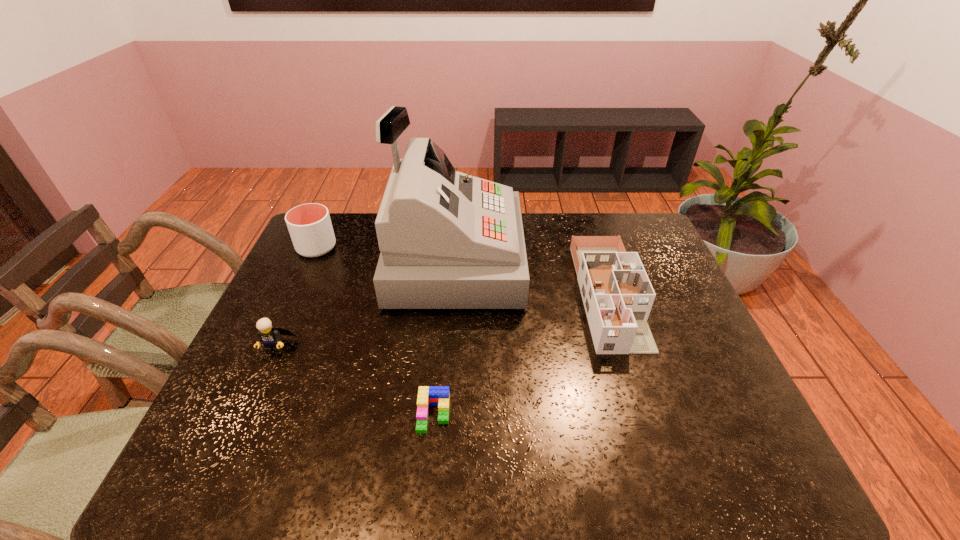
The height and width of the screenshot is (540, 960). Identify the location of blank space at the far edge of the desktop. (540, 219).

Locate an element on the screen. This screenshot has width=960, height=540. free location at the near edge is located at coordinates (468, 453).

Where is `free spot at the left edge of the desktop`? This screenshot has width=960, height=540. free spot at the left edge of the desktop is located at coordinates (272, 403).

Find the location of a particular element. The width and height of the screenshot is (960, 540). vacant position at the right edge of the desktop is located at coordinates (683, 389).

You are a GUI agent. You are given a task and a screenshot of the screen. Output one action in this format:
    pyautogui.click(x=<x>, y=<y>)
    Task: Click on the vacant area at the near left corner
    
    Given the screenshot: What is the action you would take?
    coord(256,463)

Where is `free space at the far right corner`? The image size is (960, 540). free space at the far right corner is located at coordinates (639, 224).

In order to click on free spot between the cash register and the left Lego in this screenshot , I will do `click(364, 303)`.

The image size is (960, 540). In order to click on unoccupied position between the tallest object and the farther Lego in this screenshot , I will do `click(364, 303)`.

This screenshot has width=960, height=540. I want to click on free spot between the shorter Lego and the farther Lego, so click(354, 380).

At what (x,y) coordinates should I click in order to perform the action: click on free space between the dollhouse and the tallest object. Please return your answer as a coordinate pair (x, y). This screenshot has width=960, height=540. Looking at the image, I should click on (531, 278).